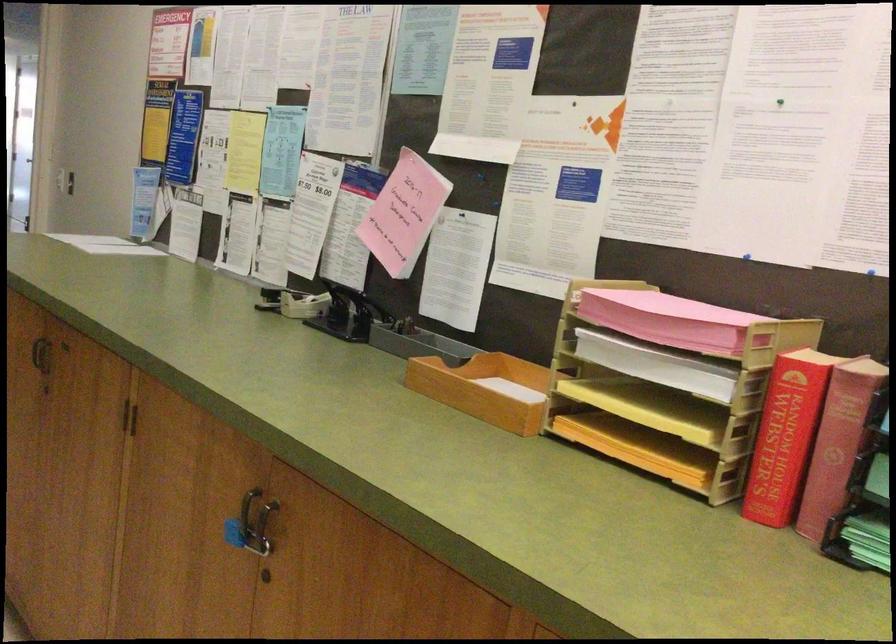
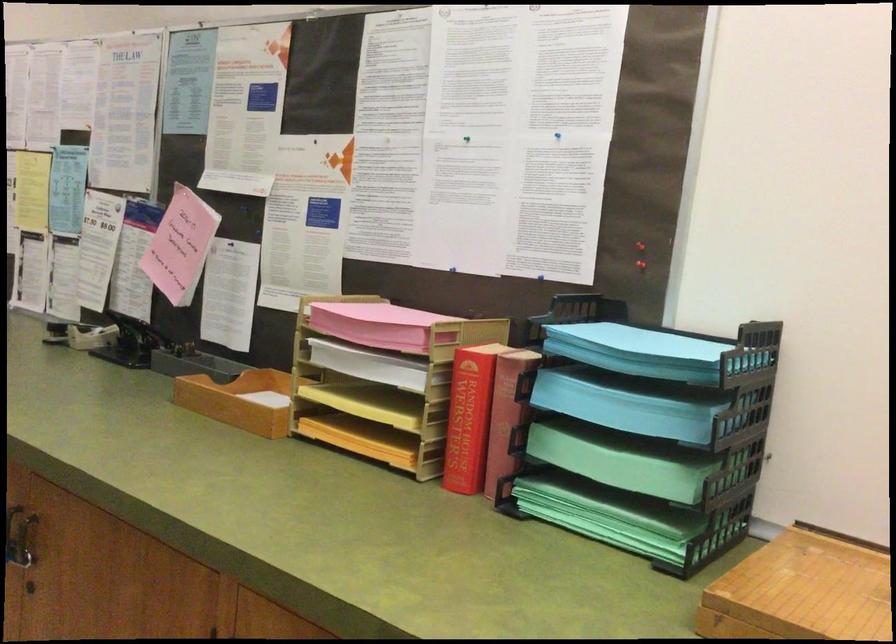
Find the pixel in the second image that matches [791,438] in the first image.

(469, 418)